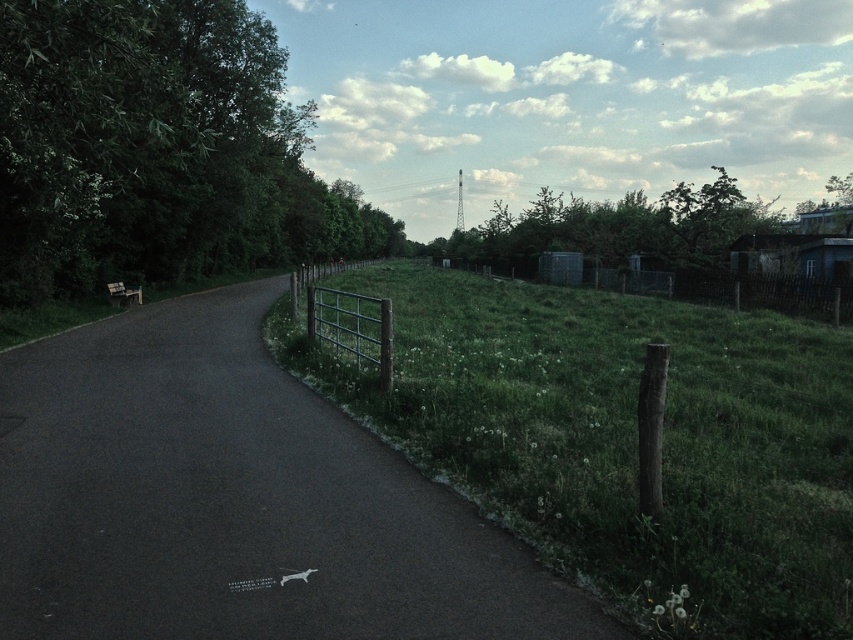
Who is higher up, dark asphalt road at center or wooden fence at right?

wooden fence at right

From the picture: Who is shorter, dark asphalt road at center or wooden fence at right?

With less height is dark asphalt road at center.

Between point (360, 499) and point (634, 288), which one is positioned behind?

The point (634, 288) is behind.

Locate an element on the screen. The width and height of the screenshot is (853, 640). dark asphalt road at center is located at coordinates (234, 500).

Find the location of a particular element. The width and height of the screenshot is (853, 640). dark asphalt road at center is located at coordinates tap(234, 500).

Is point (148, 333) positioned behind point (607, 224)?

No, (148, 333) is in front of (607, 224).

Where is `dark asphalt road at center`? This screenshot has width=853, height=640. dark asphalt road at center is located at coordinates (234, 500).

Is green leafy tree at center positioned before wooden fence at right?

No, it is behind wooden fence at right.

Who is taller, green leafy tree at center or wooden fence at right?

With more height is green leafy tree at center.

Locate an element on the screen. The image size is (853, 640). green leafy tree at center is located at coordinates (616, 228).